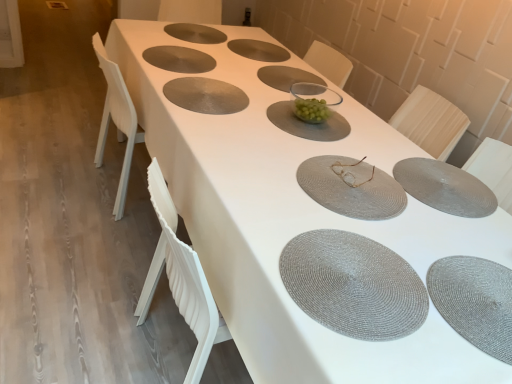
This screenshot has width=512, height=384. What are the coordinates of `free space between matte gray placemat at upper center, the third tableware from the top, and gold metallic glasses at center, which is the fourth tableware from bottom to top` in the screenshot? It's located at [249, 110].